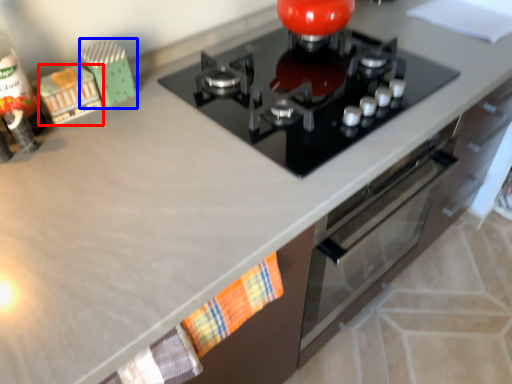
Question: Which point is further to the camera, toy (highlighted by a red box) or toy (highlighted by a blue box)?

Choices:
 (A) toy
 (B) toy

Answer: (B)